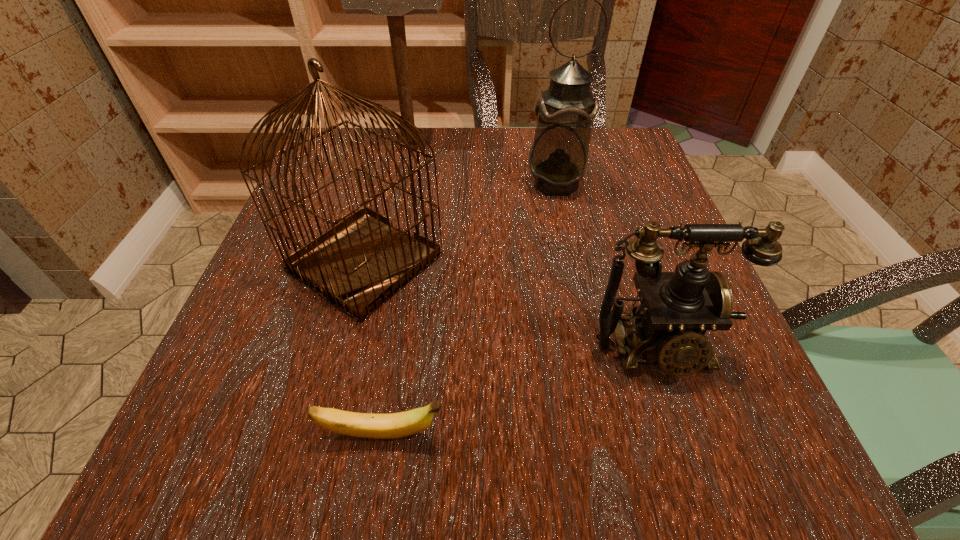
At what (x,y) coordinates should I click in order to perform the action: click on vacant region located at the stem of the banana. Please return your answer as a coordinate pair (x, y). The height and width of the screenshot is (540, 960). Looking at the image, I should click on (676, 434).

The height and width of the screenshot is (540, 960). What are the coordinates of `mallet at the far edge` in the screenshot? It's located at (394, 0).

Find the location of a particular element. This screenshot has height=540, width=960. oil lamp that is at the far edge is located at coordinates tap(558, 159).

Find the location of a particular element. object at the near edge is located at coordinates (366, 425).

Find the location of `mallet located at the left edge`. mallet located at the left edge is located at coordinates (394, 0).

Locate an element on the screen. The image size is (960, 540). birdcage at the left edge is located at coordinates (361, 262).

Locate an element on the screen. oil lamp at the right edge is located at coordinates (558, 159).

The image size is (960, 540). I want to click on telephone that is at the right edge, so click(677, 308).

Where is `object located at the far left corner`? object located at the far left corner is located at coordinates (394, 0).

This screenshot has width=960, height=540. Identify the location of object that is at the far right corner. (558, 159).